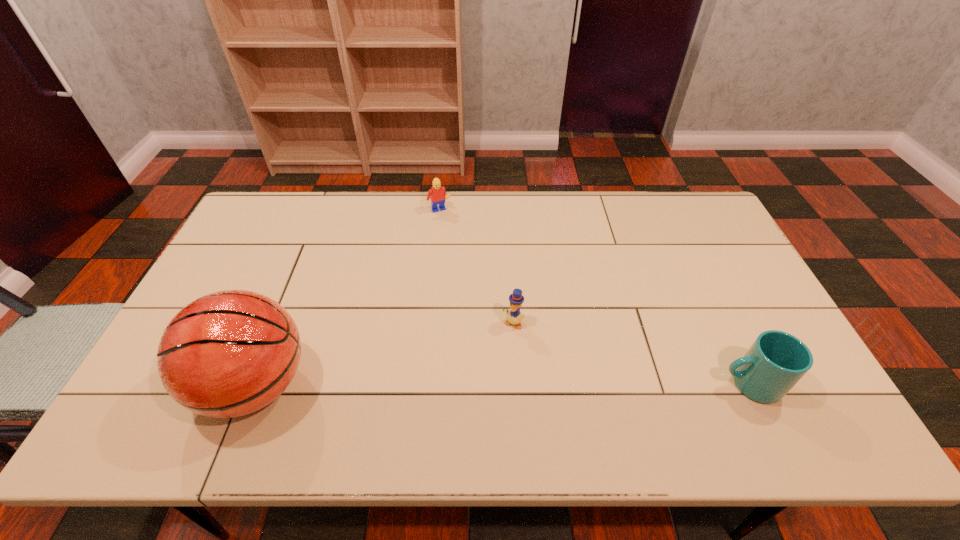
Where is `free space between the third object from left to right and the second object from left to right`? free space between the third object from left to right and the second object from left to right is located at coordinates (476, 267).

Image resolution: width=960 pixels, height=540 pixels. Find the location of `free spot between the Lego and the leftmost object`. free spot between the Lego and the leftmost object is located at coordinates (348, 298).

Identify the location of free area in between the duckling and the rightmost object. pos(632,354).

Where is `free space between the third object from right to left and the tallest object`? The width and height of the screenshot is (960, 540). free space between the third object from right to left and the tallest object is located at coordinates (348, 298).

Identify the location of free spot between the basketball and the duckling. This screenshot has width=960, height=540. (385, 354).

Locate an element on the screen. vacant region between the third object from right to left and the second farthest object is located at coordinates (476, 267).

Find the location of `object that is the third closest one to the second object from right to left`. object that is the third closest one to the second object from right to left is located at coordinates (437, 194).

Locate an element on the screen. This screenshot has width=960, height=540. the third closest object relative to the cup is located at coordinates (230, 353).

Identify the location of vacant space that satisfies the following two spatial constraints: 1. on the front side of the second object from left to right; 2. on the handle side of the cup. (420, 384).

Image resolution: width=960 pixels, height=540 pixels. Find the location of `free space in the image that satisfies the following two spatial constraints: 1. on the front side of the cup; 2. on the handle side of the farthest object`. free space in the image that satisfies the following two spatial constraints: 1. on the front side of the cup; 2. on the handle side of the farthest object is located at coordinates (420, 384).